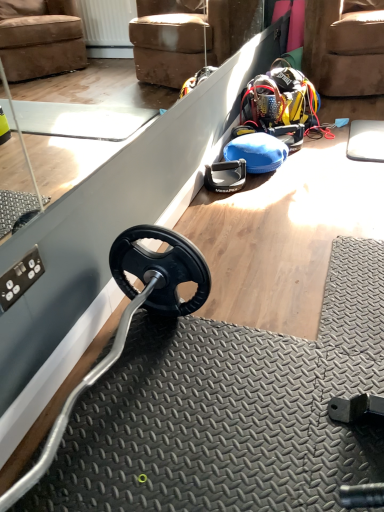
Where is `vacant area that is situated to the right of black rubber weight at center`? vacant area that is situated to the right of black rubber weight at center is located at coordinates (265, 187).